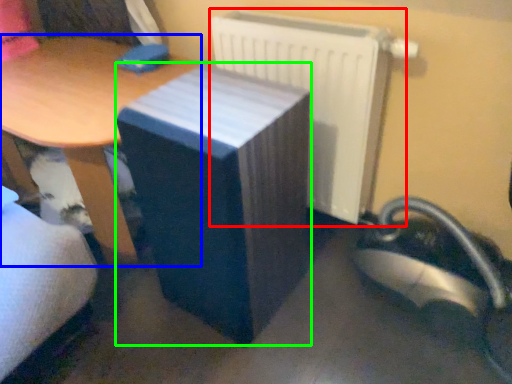
Question: Estimate the real-world distances between objects in this image. Which object is closer to radiator (highlighted by a red box), table (highlighted by a blue box) or table (highlighted by a green box)?

Choices:
 (A) table
 (B) table

Answer: (B)